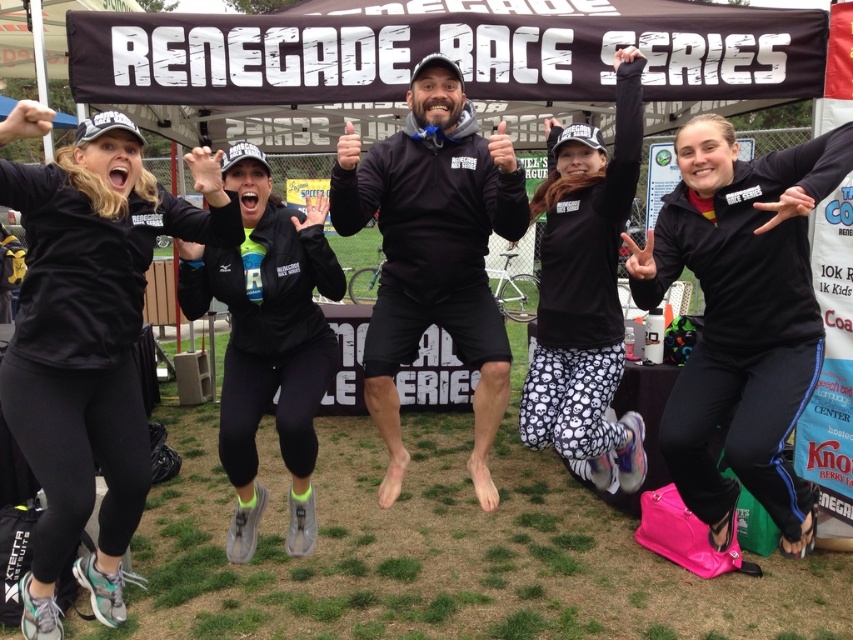
Which is behind, point (62, 216) or point (752, 410)?

The point (752, 410) is more distant.

Can you confirm if matte black leggings at lower left is wider than black matte leggings at center?

Incorrect, matte black leggings at lower left's width does not surpass black matte leggings at center's.

Who is more forward, [26,403] or [689,260]?

Positioned in front is point [26,403].

You are a GUI agent. You are given a task and a screenshot of the screen. Output one action in this format:
    pyautogui.click(x=<x>, y=<y>)
    Task: Click on the matte black leggings at lower left
    
    Given the screenshot: What is the action you would take?
    pyautogui.click(x=90, y=346)

Looking at this image, which of these two, black matte leggings at center or black matte jacket at center, stands shorter?

With less height is black matte jacket at center.

Between point (664, 252) and point (277, 259), which one is positioned behind?

Point (664, 252)

Is point (759, 458) in front of point (264, 360)?

Yes, it is in front of point (264, 360).

The image size is (853, 640). Find the location of `black matte leggings at center`. black matte leggings at center is located at coordinates (741, 317).

Image resolution: width=853 pixels, height=640 pixels. What do you see at coordinates (90, 346) in the screenshot?
I see `matte black leggings at lower left` at bounding box center [90, 346].

Which is in front, point (28, 451) or point (631, 484)?

Point (28, 451) is more forward.

This screenshot has height=640, width=853. I want to click on matte black leggings at lower left, so click(x=90, y=346).